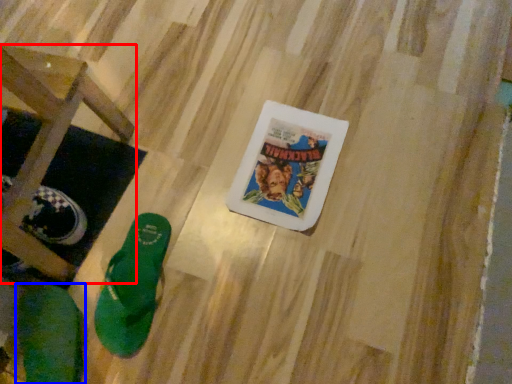
Question: Which object appears farthest to the camera in this image, furniture (highlighted by a red box) or footwear (highlighted by a blue box)?

Choices:
 (A) furniture
 (B) footwear

Answer: (B)